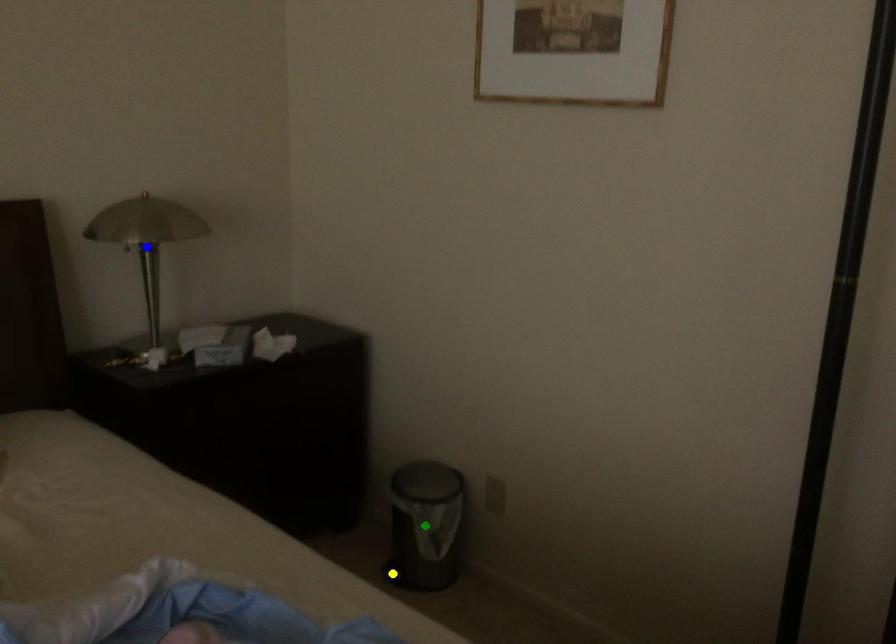
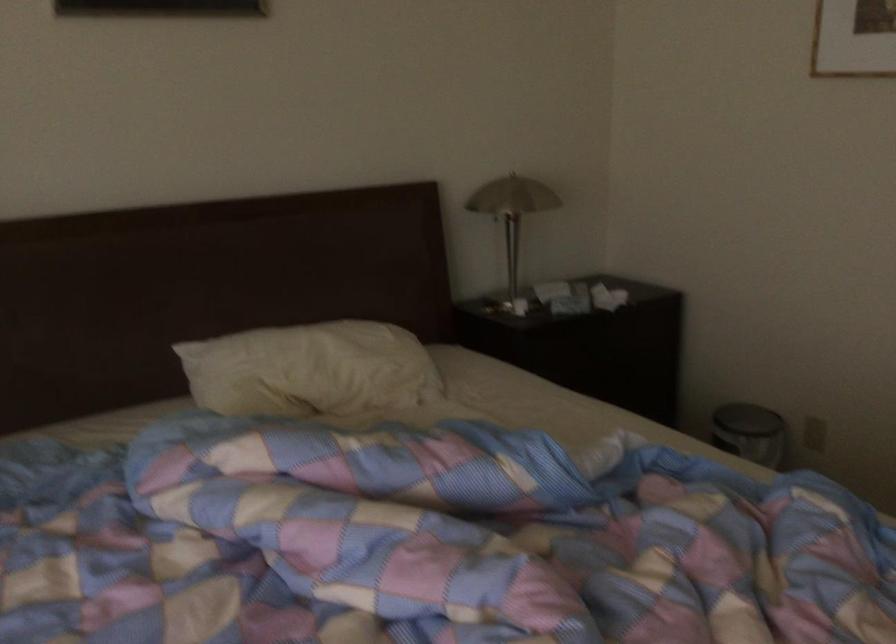
I am providing you with two images of the same scene from different viewpoints. Three points are marked in image1. Which point corresponds to a part or object that is occluded in image2?In image1, three points are marked. Which of them correspond to a part or object that is occluded in image2?Among the three points shown in image1, which one corresponds to a part or object that is no longer visible due to occlusion in image2?

yellow point, green point